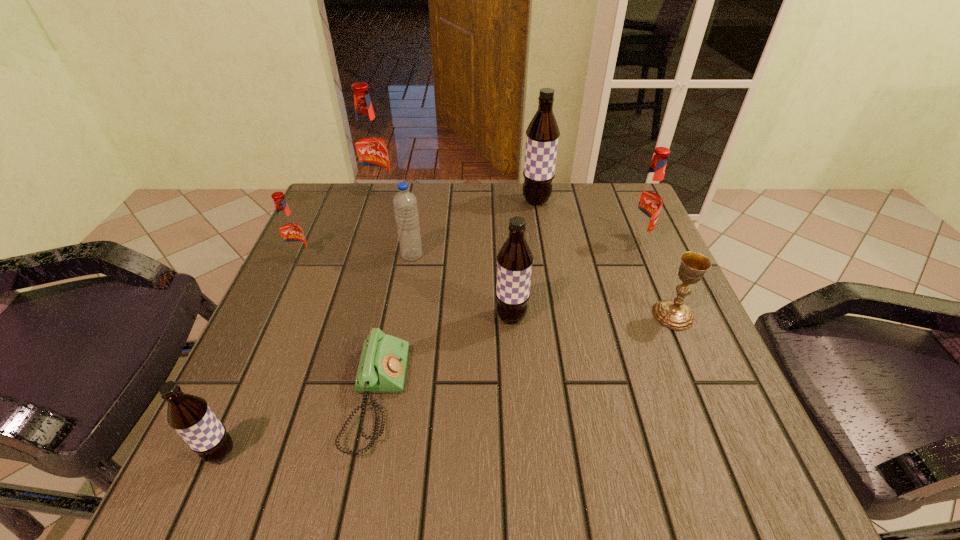
Image resolution: width=960 pixels, height=540 pixels. Identify the location of object that is positioned at the near left corner. (190, 416).

This screenshot has height=540, width=960. Find the location of `object at the far right corner`. object at the far right corner is located at coordinates (648, 198).

Where is `vacant space at the far edge of the desktop`? The width and height of the screenshot is (960, 540). vacant space at the far edge of the desktop is located at coordinates (560, 226).

The height and width of the screenshot is (540, 960). In order to click on vacant space at the left edge of the desktop in this screenshot , I will do `click(246, 434)`.

Image resolution: width=960 pixels, height=540 pixels. In the image, there is a desktop. What are the coordinates of `vacant region at the right edge` in the screenshot? It's located at (618, 248).

You are a GUI agent. You are given a task and a screenshot of the screen. Output one action in this format:
    pyautogui.click(x=<x>, y=<y>)
    Task: Click on the free region at the far right corner of the desktop
    Image resolution: width=960 pixels, height=540 pixels.
    Given the screenshot: What is the action you would take?
    (588, 219)

This screenshot has height=540, width=960. In order to click on free spot at the near right corner of the desktop in this screenshot , I will do `click(676, 487)`.

What are the coordinates of `free space between the water bottle and the nearest brown root beer` in the screenshot? It's located at (316, 354).

Where is `free space between the smallest brown root beer and the gold chalice`? Image resolution: width=960 pixels, height=540 pixels. free space between the smallest brown root beer and the gold chalice is located at coordinates (447, 384).

Identify the location of vacant space that is in between the nearest red root beer and the gold chalice. (487, 288).